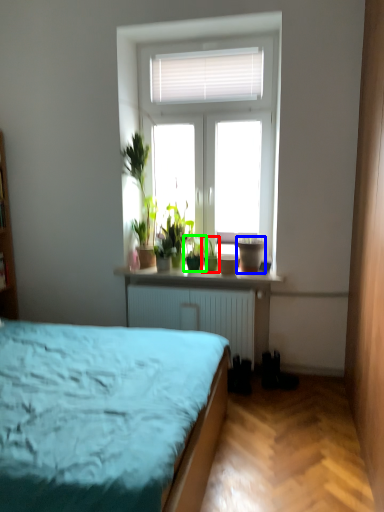
Question: Which object is the farthest from houseplant (highlighted by a red box)? Choose among these: flowerpot (highlighted by a blue box) or houseplant (highlighted by a green box).

Choices:
 (A) flowerpot
 (B) houseplant

Answer: (A)